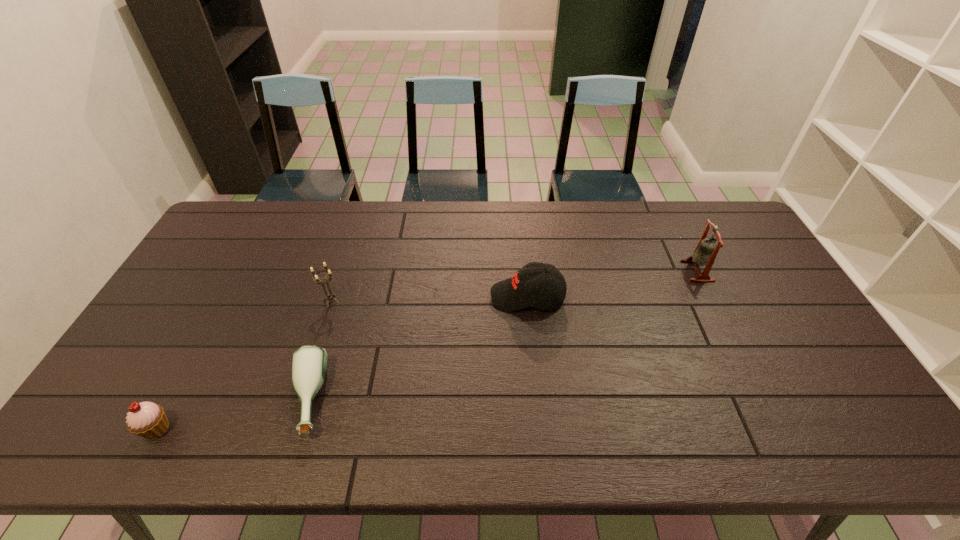
At what (x,y) coordinates should I click in order to perform the action: click on the tallest object. Please return your answer as a coordinate pair (x, y). The width and height of the screenshot is (960, 540). Looking at the image, I should click on (707, 249).

Where is `the rightmost object`? Image resolution: width=960 pixels, height=540 pixels. the rightmost object is located at coordinates (707, 249).

Image resolution: width=960 pixels, height=540 pixels. In order to click on candle holder in this screenshot , I will do `click(328, 296)`.

Locate an element on the screen. This screenshot has width=960, height=540. the second object from right to left is located at coordinates (526, 288).

Where is `cupcake`? Image resolution: width=960 pixels, height=540 pixels. cupcake is located at coordinates (146, 419).

Where is `the shortest object`? the shortest object is located at coordinates (309, 364).

The height and width of the screenshot is (540, 960). I want to click on free location located 0.330m on the front of the tallest object, so point(750,375).

Locate an element on the screen. Image resolution: width=960 pixels, height=540 pixels. free location located 0.090m on the left of the candle holder is located at coordinates (290, 301).

This screenshot has height=540, width=960. I want to click on vacant space located 0.100m on the front-facing side of the baseball cap, so click(458, 296).

Locate an element on the screen. The height and width of the screenshot is (540, 960). vacant space located 0.110m on the front-facing side of the baseball cap is located at coordinates (454, 296).